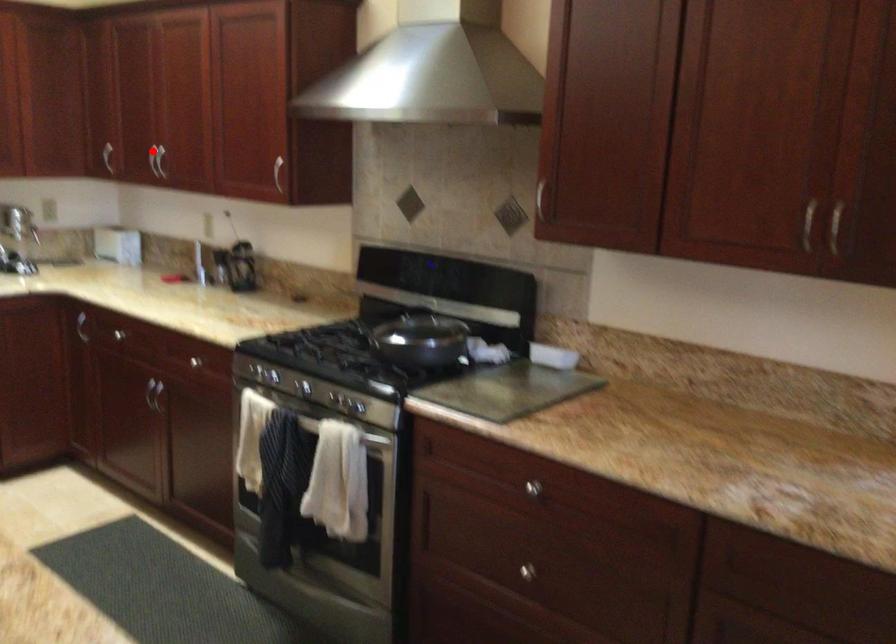
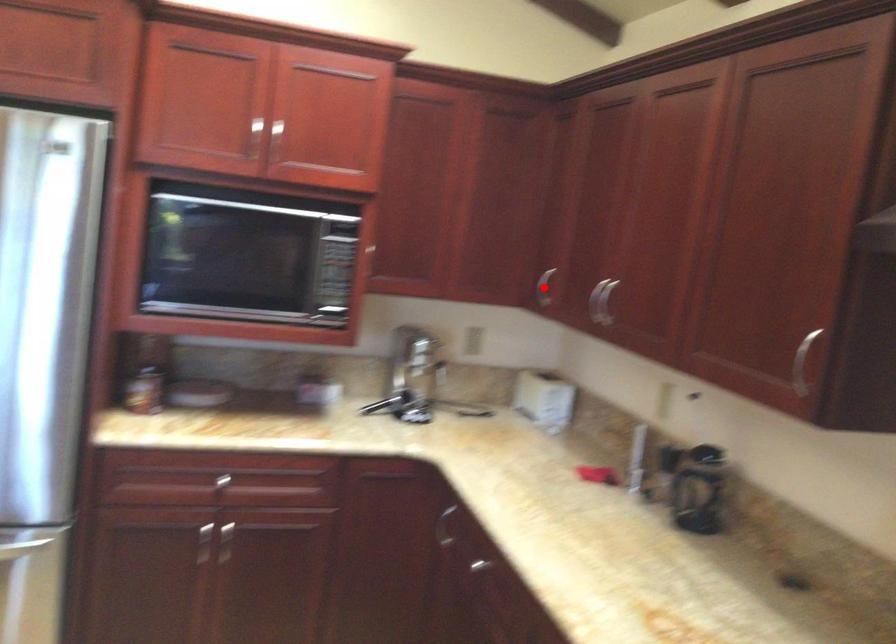
I am providing you with two images of the same scene from different viewpoints. A red point is marked on the first image and another point is marked on the second image. Is the red point in image1 aligned with the point shown in image2?

No